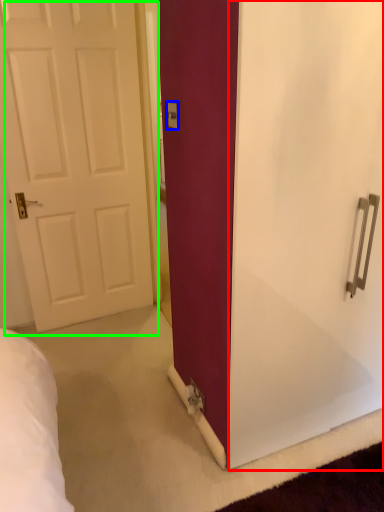
Question: Based on their relative distances, which object is farther from screen door (highlighted by a red box)? Choose from electric outlet (highlighted by a blue box) and door (highlighted by a green box).

Choices:
 (A) electric outlet
 (B) door

Answer: (B)